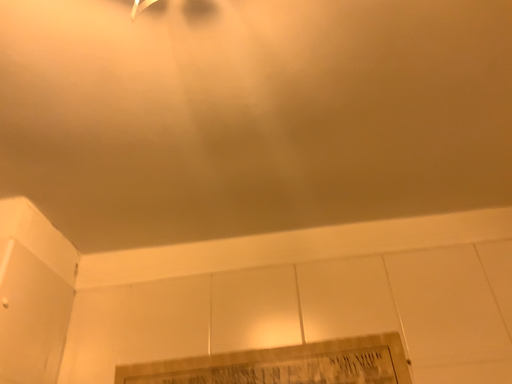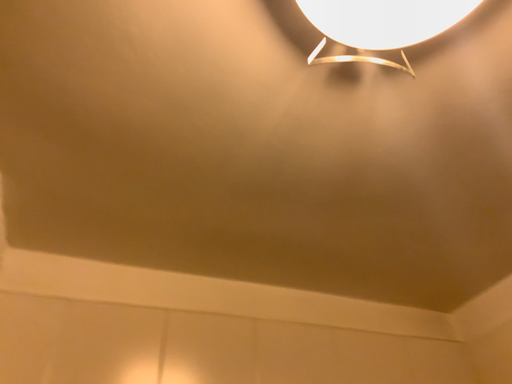
Question: How did the camera likely rotate when shooting the video?

Choices:
 (A) rotated left
 (B) rotated right

Answer: (B)